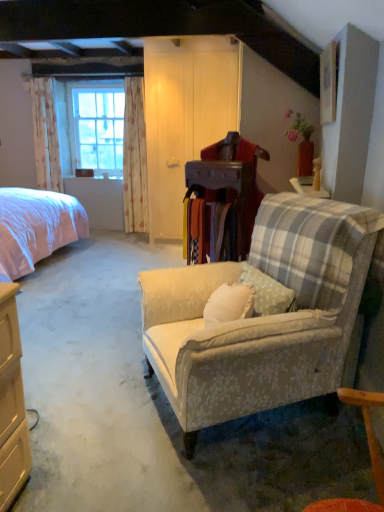
Question: Would you say clear glass window at left is outside floral fabric curtain at left, which appears as the second curtain when viewed from the left?

Choices:
 (A) yes
 (B) no

Answer: (A)

Question: Does clear glass window at left have a smaller size compared to floral fabric curtain at left, which is counted as the 1th curtain, starting from the right?

Choices:
 (A) yes
 (B) no

Answer: (B)

Question: Is floral fabric curtain at left, which is counted as the 1th curtain, starting from the right, inside clear glass window at left?

Choices:
 (A) yes
 (B) no

Answer: (B)

Question: Does clear glass window at left have a lesser width compared to floral fabric curtain at left, which appears as the second curtain when viewed from the left?

Choices:
 (A) yes
 (B) no

Answer: (A)

Question: Is clear glass window at left taller than floral fabric curtain at left, which appears as the second curtain when viewed from the left?

Choices:
 (A) yes
 (B) no

Answer: (B)

Question: Could you tell me if clear glass window at left is turned towards floral fabric curtain at left, which is counted as the 1th curtain, starting from the right?

Choices:
 (A) yes
 (B) no

Answer: (B)

Question: Considering the relative positions of floral fabric curtain at left, which is counted as the 1th curtain, starting from the right, and white floral fabric curtain at left, the first curtain positioned from the left, in the image provided, is floral fabric curtain at left, which is counted as the 1th curtain, starting from the right, to the left of white floral fabric curtain at left, the first curtain positioned from the left, from the viewer's perspective?

Choices:
 (A) no
 (B) yes

Answer: (A)

Question: From a real-world perspective, is floral fabric curtain at left, which is counted as the 1th curtain, starting from the right, on white floral fabric curtain at left, the first curtain positioned from the left?

Choices:
 (A) yes
 (B) no

Answer: (B)

Question: Can you confirm if floral fabric curtain at left, which appears as the second curtain when viewed from the left, is smaller than white floral fabric curtain at left, arranged as the 2th curtain when viewed from the right?

Choices:
 (A) no
 (B) yes

Answer: (B)

Question: Can you confirm if floral fabric curtain at left, which appears as the second curtain when viewed from the left, is wider than white floral fabric curtain at left, arranged as the 2th curtain when viewed from the right?

Choices:
 (A) yes
 (B) no

Answer: (B)

Question: From a real-world perspective, does floral fabric curtain at left, which is counted as the 1th curtain, starting from the right, sit lower than white floral fabric curtain at left, arranged as the 2th curtain when viewed from the right?

Choices:
 (A) yes
 (B) no

Answer: (A)

Question: Does floral fabric curtain at left, which is counted as the 1th curtain, starting from the right, have a lesser width compared to white floral fabric curtain at left, the first curtain positioned from the left?

Choices:
 (A) no
 (B) yes

Answer: (B)

Question: From a real-world perspective, is pink fabric bed at left located beneath white floral fabric curtain at left, the first curtain positioned from the left?

Choices:
 (A) no
 (B) yes

Answer: (B)